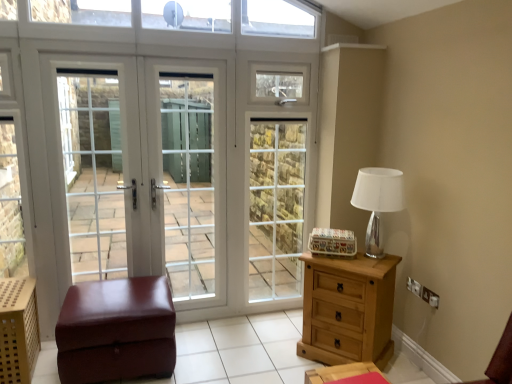
The height and width of the screenshot is (384, 512). I want to click on vacant space situated above white glass door at center (from a real-world perspective), so click(134, 39).